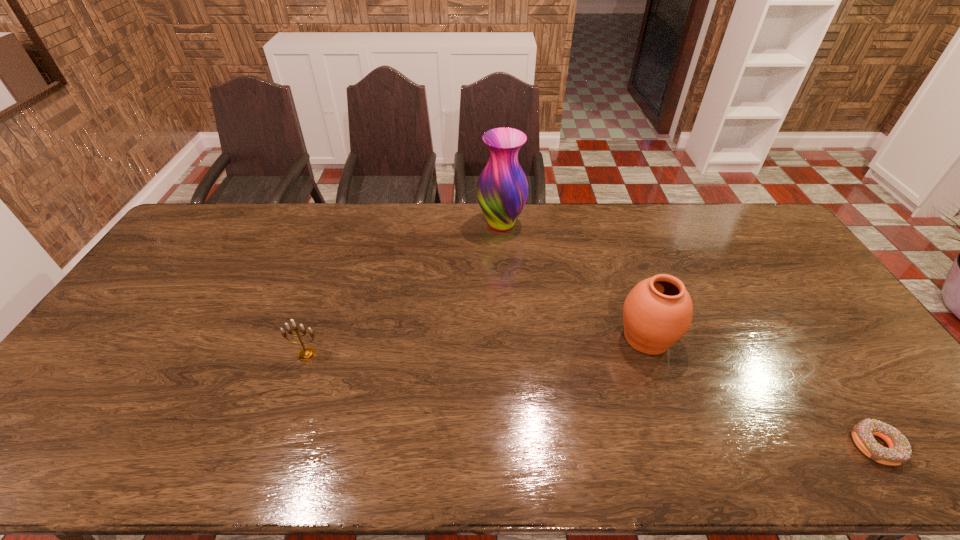
Locate an element on the screen. The height and width of the screenshot is (540, 960). object that can be found as the third closest to the nearest object is located at coordinates (307, 353).

Identify which object is located as the third nearest to the urn. Please provide its 2D coordinates. Your answer should be formatted as a tuple, i.e. [(x, y)], where the tuple contains the x and y coordinates of a point satisfying the conditions above.

[(307, 353)]

You are a GUI agent. You are given a task and a screenshot of the screen. Output one action in this format:
    pyautogui.click(x=<x>, y=<y>)
    Task: Click on the vacant area that satisfies the following two spatial constraints: 1. on the front side of the leftmost object; 2. on the right side of the nearest object
    Image resolution: width=960 pixels, height=540 pixels.
    Given the screenshot: What is the action you would take?
    pyautogui.click(x=276, y=446)

Image resolution: width=960 pixels, height=540 pixels. Find the location of `vacant space that satisfies the following two spatial constraints: 1. on the back side of the third shortest object; 2. on the right side of the leftmost object`. vacant space that satisfies the following two spatial constraints: 1. on the back side of the third shortest object; 2. on the right side of the leftmost object is located at coordinates (313, 338).

This screenshot has height=540, width=960. I want to click on blank space that satisfies the following two spatial constraints: 1. on the front side of the second tallest object; 2. on the left side of the third object from right to left, so click(508, 338).